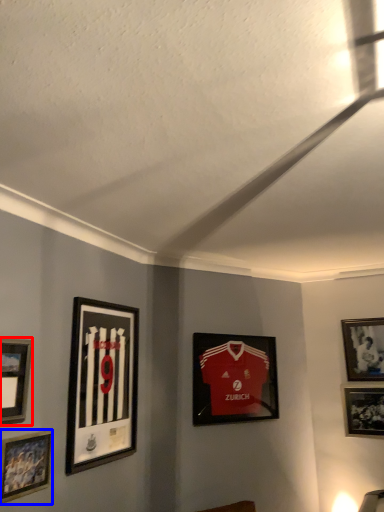
Question: Which point is further to the camera, picture frame (highlighted by a red box) or picture frame (highlighted by a blue box)?

Choices:
 (A) picture frame
 (B) picture frame

Answer: (B)